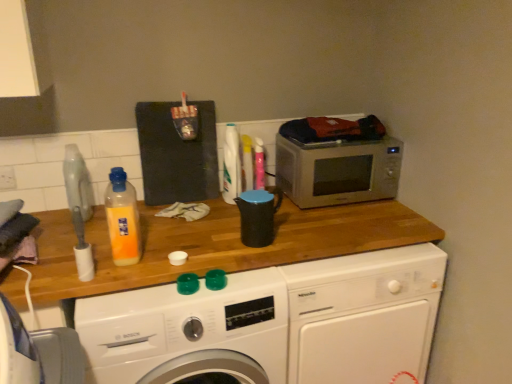
Question: From a real-world perspective, is white glossy washing machine at center, positioned as the first washing machine in right-to-left order, on top of black plastic kettle at center?

Choices:
 (A) no
 (B) yes

Answer: (A)

Question: Is white glossy washing machine at center, the second washing machine viewed from the left, oriented towards black plastic kettle at center?

Choices:
 (A) no
 (B) yes

Answer: (A)

Question: From a real-world perspective, is white glossy washing machine at center, the second washing machine viewed from the left, under black plastic kettle at center?

Choices:
 (A) no
 (B) yes

Answer: (B)

Question: Is white glossy washing machine at center, the second washing machine viewed from the left, smaller than black plastic kettle at center?

Choices:
 (A) no
 (B) yes

Answer: (A)

Question: Is white glossy washing machine at center, the second washing machine viewed from the left, in contact with black plastic kettle at center?

Choices:
 (A) yes
 (B) no

Answer: (B)

Question: Is white glossy washing machine at center, positioned as the first washing machine in right-to-left order, behind black plastic kettle at center?

Choices:
 (A) no
 (B) yes

Answer: (A)

Question: Can you confirm if black plastic kettle at center is bigger than translucent plastic bottle at center?

Choices:
 (A) yes
 (B) no

Answer: (A)

Question: Is the surface of black plastic kettle at center in direct contact with translucent plastic bottle at center?

Choices:
 (A) no
 (B) yes

Answer: (A)

Question: Considering the relative sizes of black plastic kettle at center and translucent plastic bottle at center in the image provided, is black plastic kettle at center wider than translucent plastic bottle at center?

Choices:
 (A) no
 (B) yes

Answer: (B)

Question: Is black plastic kettle at center at the left side of translucent plastic bottle at center?

Choices:
 (A) no
 (B) yes

Answer: (A)

Question: Can you confirm if black plastic kettle at center is shorter than translucent plastic bottle at center?

Choices:
 (A) no
 (B) yes

Answer: (B)

Question: Is black plastic kettle at center not close to translucent plastic bottle at center?

Choices:
 (A) yes
 (B) no

Answer: (B)

Question: Is translucent plastic bottle at center positioned beyond the bounds of black plastic kettle at center?

Choices:
 (A) yes
 (B) no

Answer: (A)